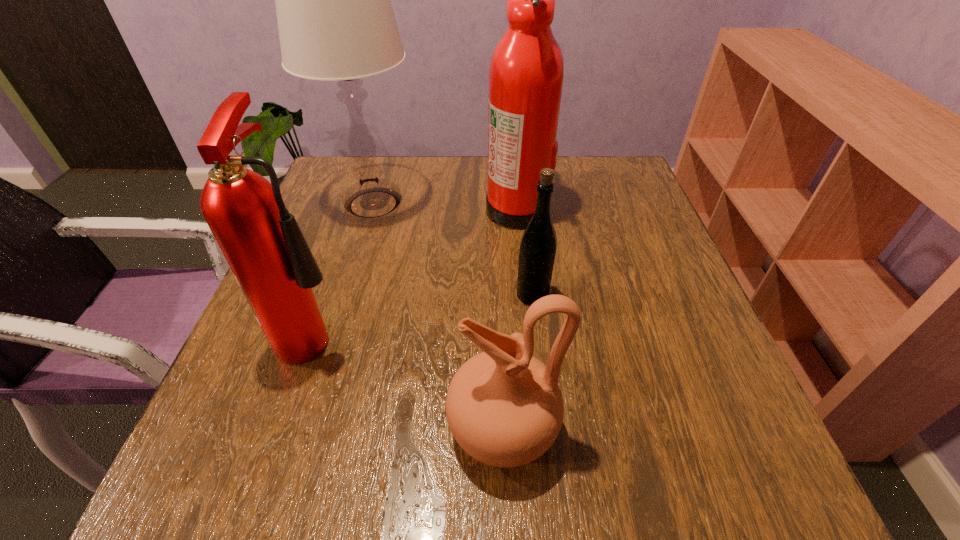
The width and height of the screenshot is (960, 540). Find the location of `fire extinguisher that is at the left edge`. fire extinguisher that is at the left edge is located at coordinates [261, 241].

Where is `object located in the far left corner section of the desktop`? The height and width of the screenshot is (540, 960). object located in the far left corner section of the desktop is located at coordinates (335, 19).

In the image, there is a desktop. What are the coordinates of `vacant space at the far edge` in the screenshot? It's located at (466, 166).

In the image, there is a desktop. Identify the location of free space at the near edge. This screenshot has height=540, width=960. (372, 444).

In the image, there is a desktop. Where is `vacant space at the left edge`? This screenshot has height=540, width=960. vacant space at the left edge is located at coordinates (308, 218).

In the image, there is a desktop. Identify the location of vacant space at the right edge. (624, 214).

The height and width of the screenshot is (540, 960). I want to click on free space at the far left corner of the desktop, so click(x=344, y=173).

The width and height of the screenshot is (960, 540). Identify the location of free space at the near left corner. (281, 496).

Locate an element on the screen. The height and width of the screenshot is (540, 960). free region at the far right corner is located at coordinates (589, 187).

This screenshot has height=540, width=960. In the image, there is a desktop. What are the coordinates of `free space at the near right corner` in the screenshot? It's located at (739, 458).